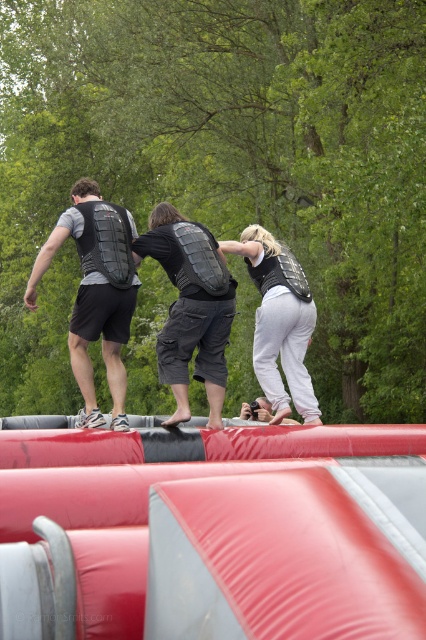
Question: Considering the real-world distances, which object is farthest from the black matte vest at center?

Choices:
 (A) matte black vest at upper left
 (B) matte black vest at center

Answer: (B)

Question: Does black matte vest at center appear on the right side of matte black vest at upper left?

Choices:
 (A) no
 (B) yes

Answer: (B)

Question: Does matte black vest at upper left have a lesser width compared to matte black vest at center?

Choices:
 (A) yes
 (B) no

Answer: (A)

Question: Which of the following is the closest to the observer?

Choices:
 (A) (115, 237)
 (B) (307, 310)
 (C) (85, 328)

Answer: (C)

Question: Does black matte vest at center come in front of matte black vest at upper left?

Choices:
 (A) no
 (B) yes

Answer: (B)

Question: Estimate the real-world distances between objects in this image. Which object is farther from the matte black vest at center?

Choices:
 (A) black matte vest at center
 (B) matte black vest at upper left

Answer: (B)